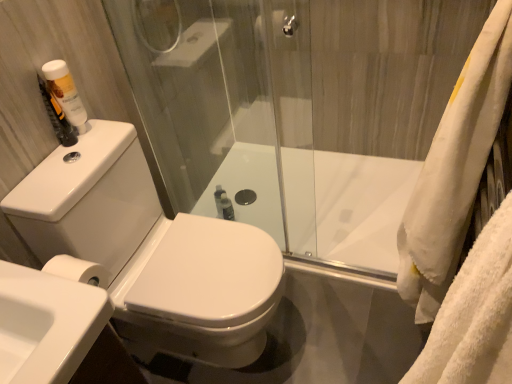
Question: In terms of width, does white glossy toilet at center look wider or thinner when compared to transparent glass shower door at upper right?

Choices:
 (A) thin
 (B) wide

Answer: (B)

Question: From their relative heights in the image, would you say white glossy toilet at center is taller or shorter than transparent glass shower door at upper right?

Choices:
 (A) tall
 (B) short

Answer: (B)

Question: Estimate the real-world distances between objects in this image. Which object is closer to the white glossy toilet at center?

Choices:
 (A) white glossy sink at lower left
 (B) transparent glass shower door at upper right
 (C) white glossy bathtub at center
 (D) white fluffy bath towel at right
 (E) white plastic bottle at upper left

Answer: (E)

Question: Based on their relative distances, which object is farther from the transparent glass shower door at upper right?

Choices:
 (A) white glossy bathtub at center
 (B) white glossy sink at lower left
 (C) white fluffy bath towel at right
 (D) white glossy toilet at center
 (E) white plastic bottle at upper left

Answer: (B)